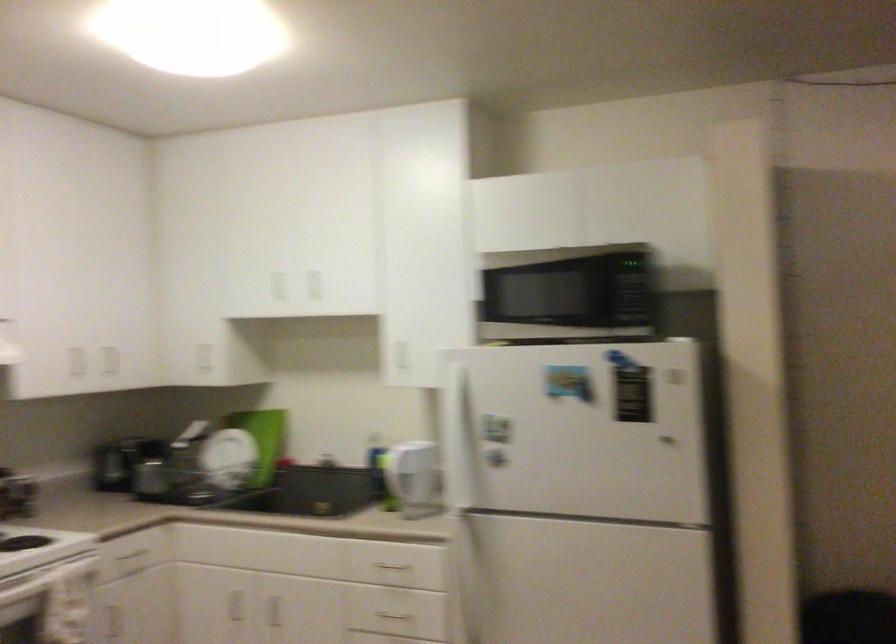
Where is `microwave button panel`? microwave button panel is located at coordinates (624, 299).